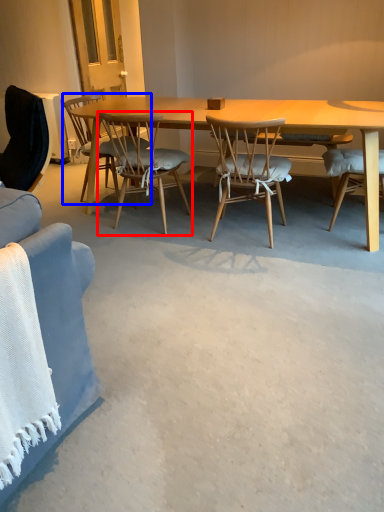
Question: Which of the following is the farthest to the observer, chair (highlighted by a red box) or chair (highlighted by a blue box)?

Choices:
 (A) chair
 (B) chair

Answer: (B)